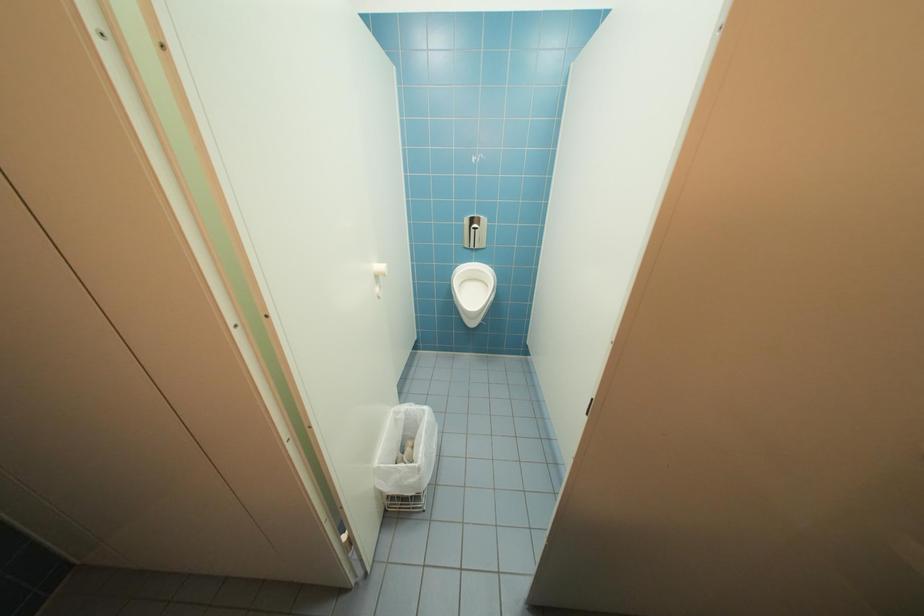
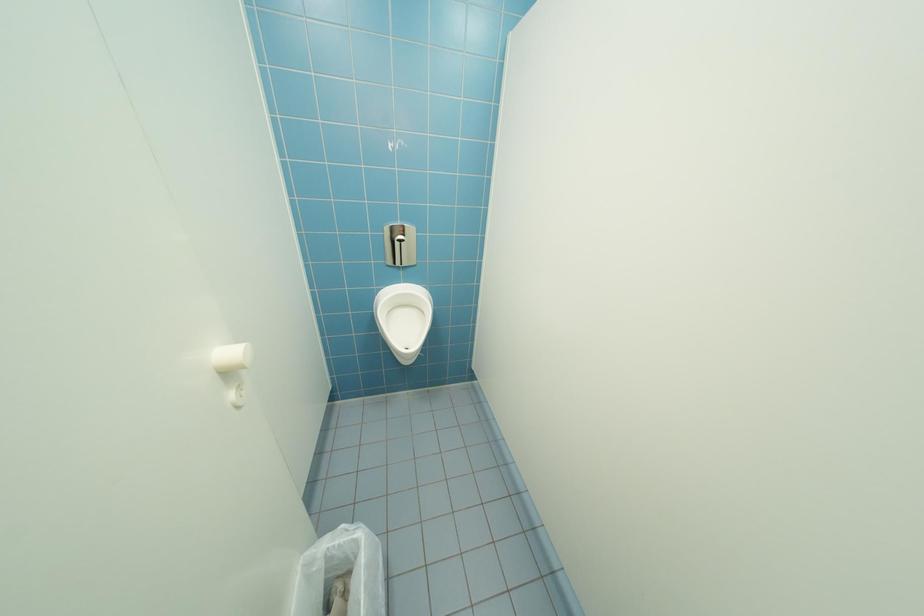
Question: Which direction would the cameraman need to move to produce the second image? Reply with the corresponding letter.

Choices:
 (A) Left
 (B) Right
 (C) Forward
 (D) Backward

Answer: (C)